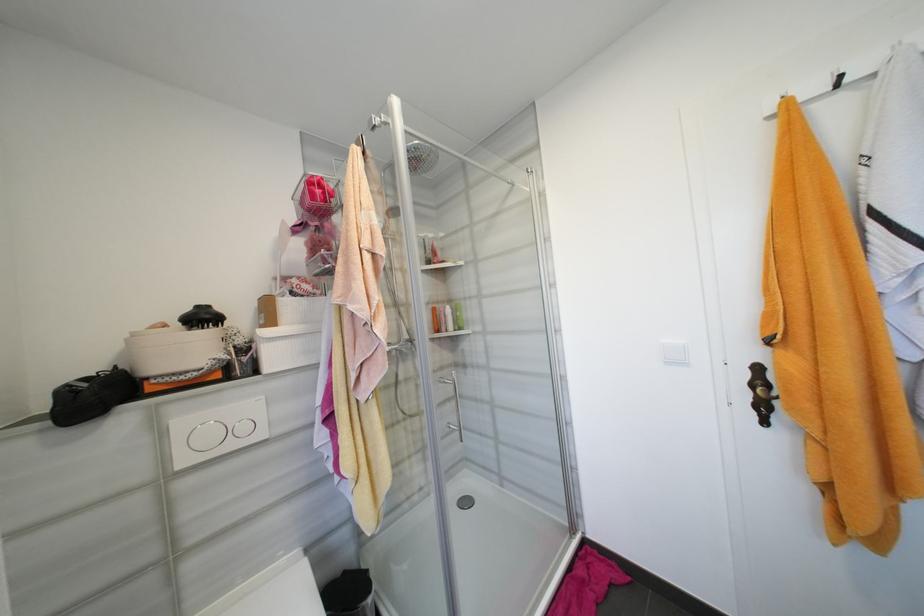
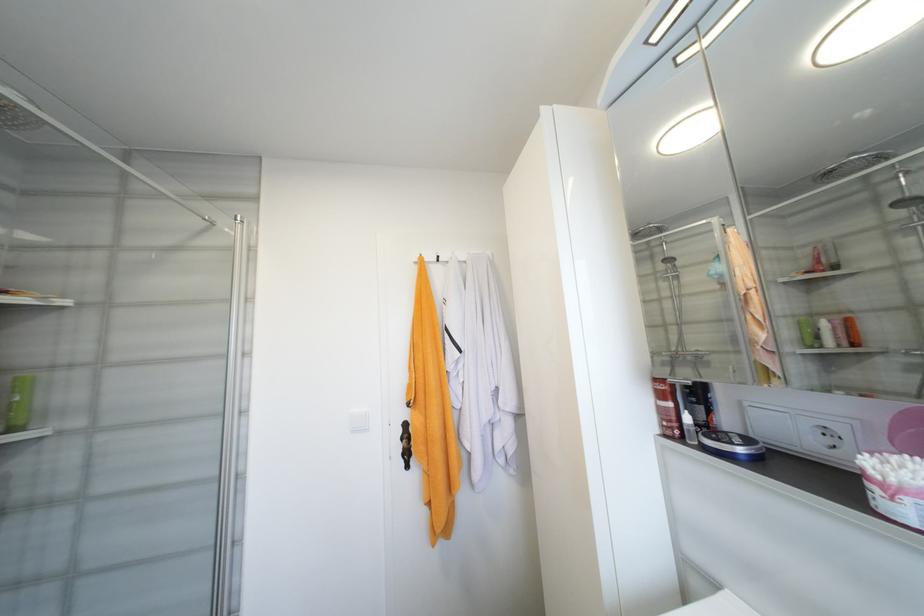
Locate, in the second image, the point that corresponds to the point at 751,395 in the first image.

(405, 448)